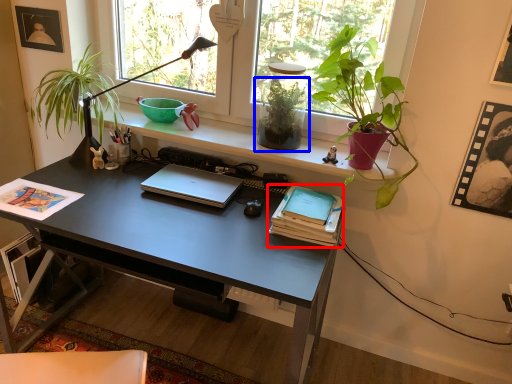
Question: Which object appears farthest to the camera in this image, paperback book (highlighted by a red box) or houseplant (highlighted by a blue box)?

Choices:
 (A) paperback book
 (B) houseplant

Answer: (B)